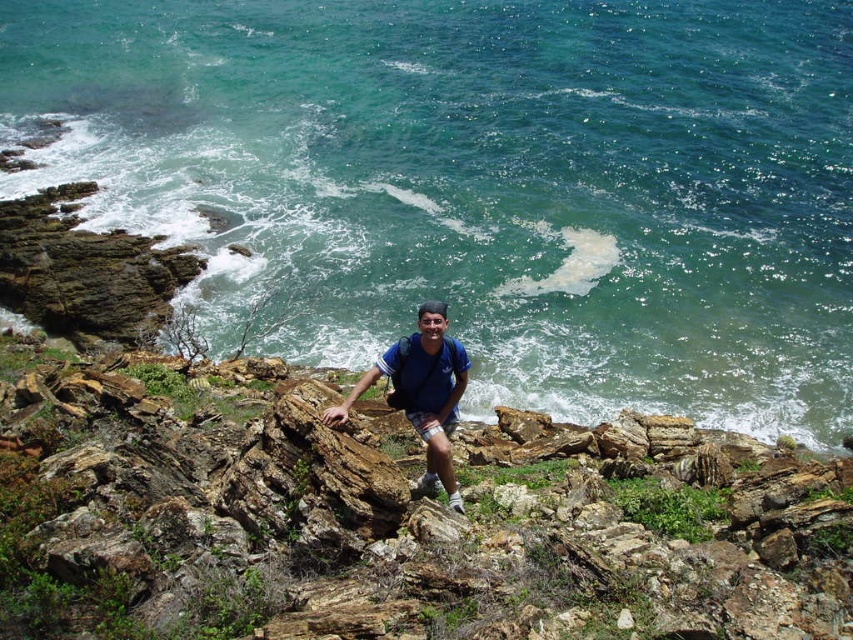
The image size is (853, 640). In order to click on green water at upper center in this screenshot , I will do `click(483, 182)`.

Which is more to the left, green water at upper center or blue fabric shirt at center?

From the viewer's perspective, blue fabric shirt at center appears more on the left side.

Describe the element at coordinates (483, 182) in the screenshot. The image size is (853, 640). I see `green water at upper center` at that location.

I want to click on green water at upper center, so click(483, 182).